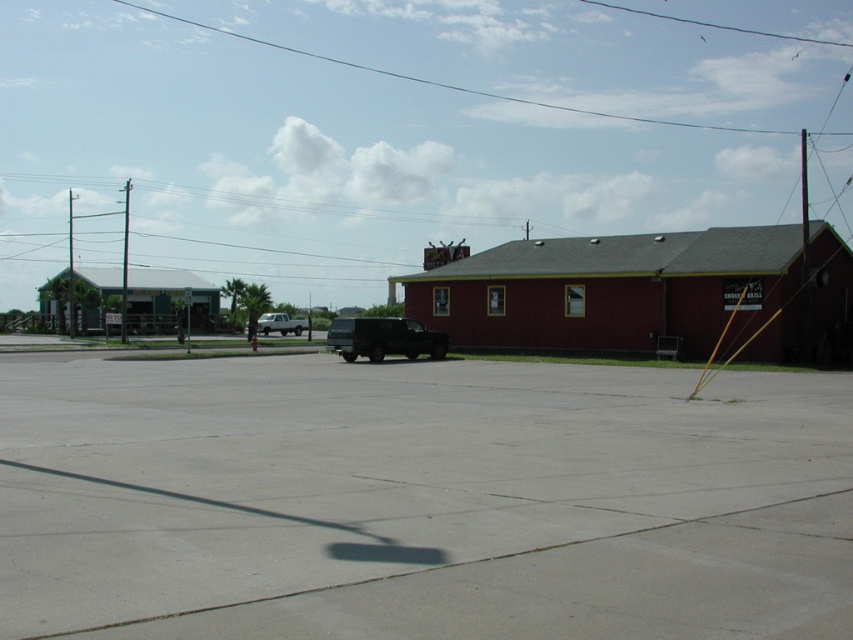
Question: Which point appears closest to the camera in this image?

Choices:
 (A) (764, 480)
 (B) (123, 332)
 (C) (283, 333)

Answer: (A)

Question: Which of the following is the closest to the observer?

Choices:
 (A) (68, 284)
 (B) (445, 337)
 (C) (756, 496)

Answer: (C)

Question: Which point is farther to the camera?

Choices:
 (A) (123, 237)
 (B) (267, 333)

Answer: (A)

Question: Can you confirm if smooth wire power line at upper center is thinner than shiny black truck at center?

Choices:
 (A) no
 (B) yes

Answer: (A)

Question: Does smooth wire power line at upper center have a larger size compared to metallic pole at left?

Choices:
 (A) no
 (B) yes

Answer: (A)

Question: Can you confirm if smooth wire power line at upper center is thinner than shiny black truck at center?

Choices:
 (A) yes
 (B) no

Answer: (B)